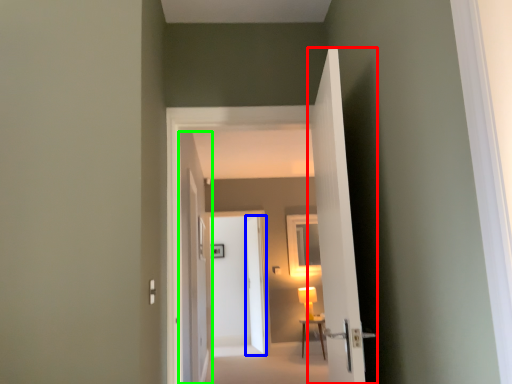
Question: Which object is positioned farthest from door (highlighted by a red box)? Select from door (highlighted by a blue box) and door (highlighted by a green box).

Choices:
 (A) door
 (B) door

Answer: (A)